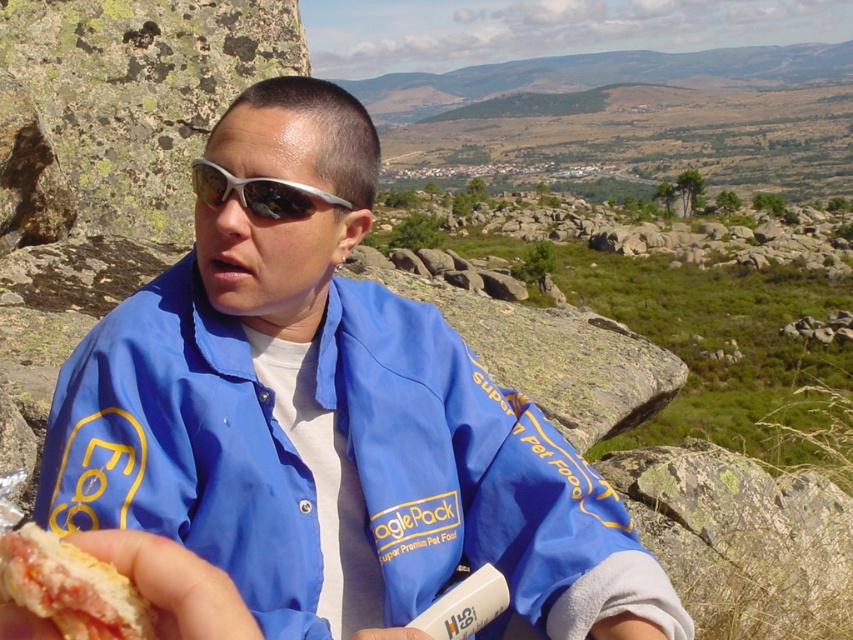
You are a photographer trying to capture the person in the scene. Since you want to focus on their face, you need to ensure the silver reflective sunglasses at center and the blue fabric jacket at center are positioned correctly. Which object should be closer to the camera to achieve this focus?

The silver reflective sunglasses at center should be closer to the camera because the blue fabric jacket at center is located below the sunglasses, meaning the sunglasses are positioned higher and closer to the front, making them easier to focus on the face.

You are a photographer trying to capture the person holding the white bread hot dog at lower left and the silver reflective sunglasses at center in a single frame. Based on their positions, which object should you focus on first to ensure both are in the frame?

The white bread hot dog at lower left is located below the silver reflective sunglasses at center, so you should focus on the silver reflective sunglasses at center first to ensure both objects are included in the frame.